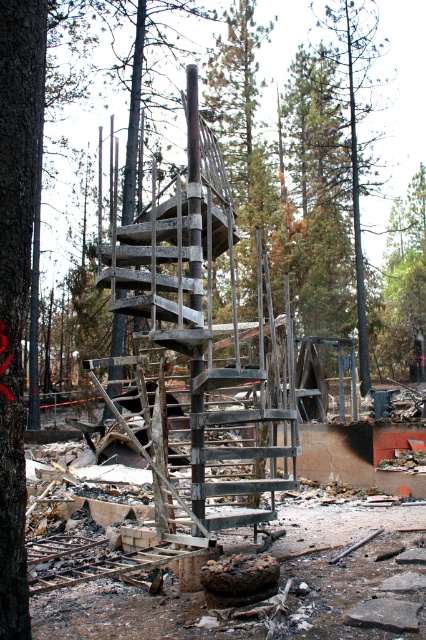
You are a firefighter assessing the scene after a wildfire. You notice two trees at the center of the image, the dark brown bark tree at center and the green pine tree at center. Which tree has a narrower trunk?

The dark brown bark tree at center has a lesser width compared to the green pine tree at center, so the dark brown bark tree at center has a narrower trunk.

You are standing at the origin point of the coordinate system in this image. The charred wood spiral staircase at center is located at point 0.522, 0.493. If you want to reach it, in which direction should you move?

The charred wood spiral staircase at center is located at point (210, 333), so you should move towards the center of the image to reach it.

You are a firefighter navigating through the debris field in the wooded area. You see two points marked as point 1 at coordinates point (207, 410) and point 2 at coordinates point (16, 358). Which point is closer to you as you approach from the front of the scene?

Point 2 at coordinates point (16, 358) is closer to you because it is in front of point 1 at coordinates point (207, 410), which is behind it according to the spatial description.